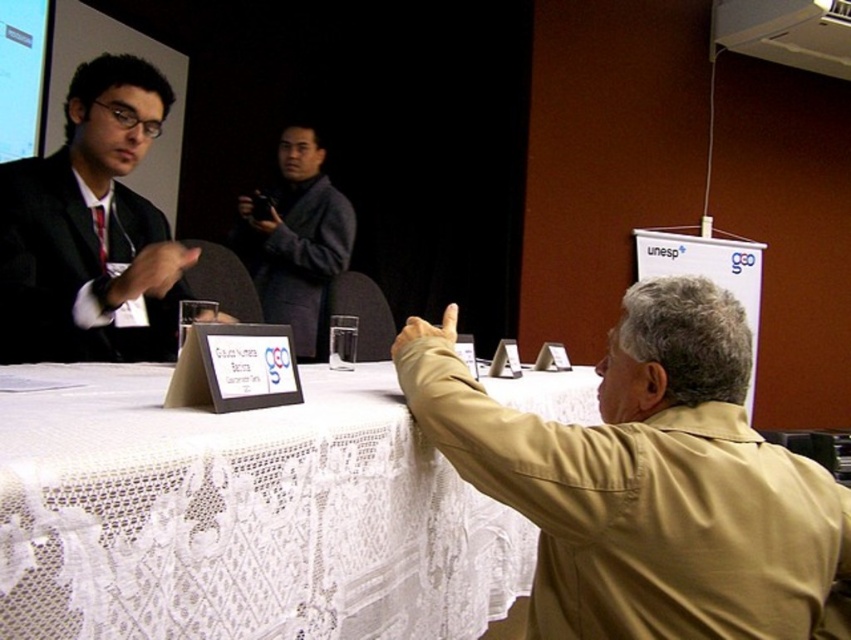
Which is behind, point (831, 44) or point (14, 99)?

Positioned behind is point (831, 44).

Is white plastic projector at upper right above matte white projection screen at upper left?

Yes, white plastic projector at upper right is above matte white projection screen at upper left.

The width and height of the screenshot is (851, 640). What do you see at coordinates (785, 33) in the screenshot? I see `white plastic projector at upper right` at bounding box center [785, 33].

Identify the location of white plastic projector at upper right. (785, 33).

Measure the distance between white lace tablecloth at center and matte black suit at left.

white lace tablecloth at center is 55.51 centimeters away from matte black suit at left.

Is white lace tablecloth at center above matte black suit at left?

Incorrect, white lace tablecloth at center is not positioned above matte black suit at left.

Is point (375, 408) more distant than point (38, 161)?

No.

Where is `white lace tablecloth at center`? white lace tablecloth at center is located at coordinates (241, 516).

Is point (284, 253) farther from camera compared to point (10, 4)?

Yes, it is.

Which is behind, point (278, 140) or point (21, 22)?

Positioned behind is point (278, 140).

Find the location of a particular element. dark gray suit at center is located at coordinates (295, 237).

Where is `dark gray suit at center`? dark gray suit at center is located at coordinates (x=295, y=237).